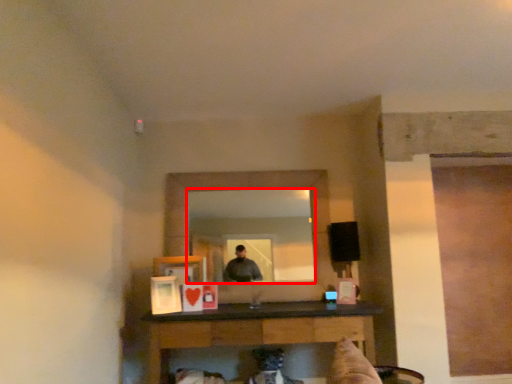
Question: Considering the relative positions of mirror (annotated by the red box) and table in the image provided, where is mirror (annotated by the red box) located with respect to the staircase?

Choices:
 (A) left
 (B) right

Answer: (A)